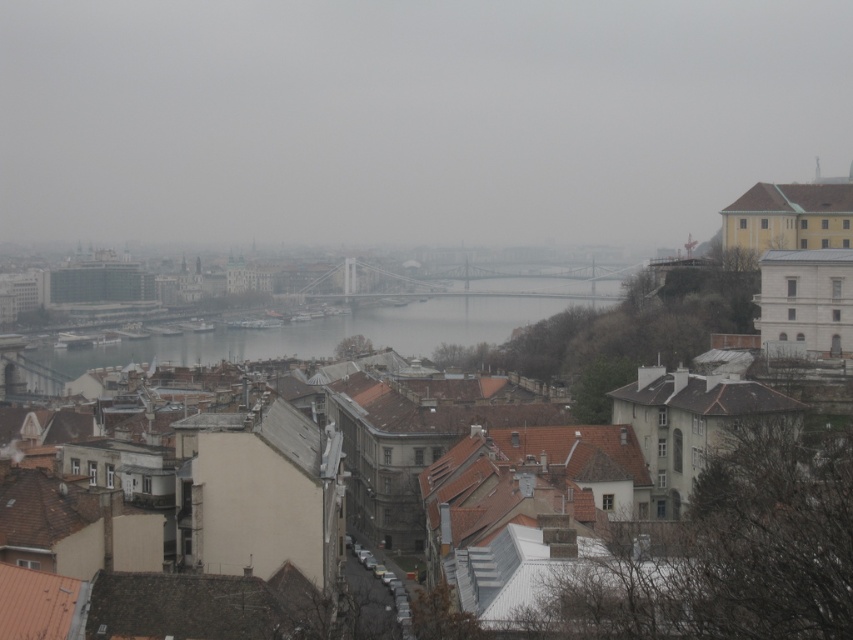
Question: Is brown tiled roofs at center to the right of gray concrete water at center from the viewer's perspective?

Choices:
 (A) yes
 (B) no

Answer: (A)

Question: Which object appears closest to the camera in this image?

Choices:
 (A) brown tiled roofs at center
 (B) gray concrete water at center

Answer: (A)

Question: Is brown tiled roofs at center to the right of gray concrete water at center from the viewer's perspective?

Choices:
 (A) no
 (B) yes

Answer: (B)

Question: Does brown tiled roofs at center have a larger size compared to gray concrete water at center?

Choices:
 (A) yes
 (B) no

Answer: (B)